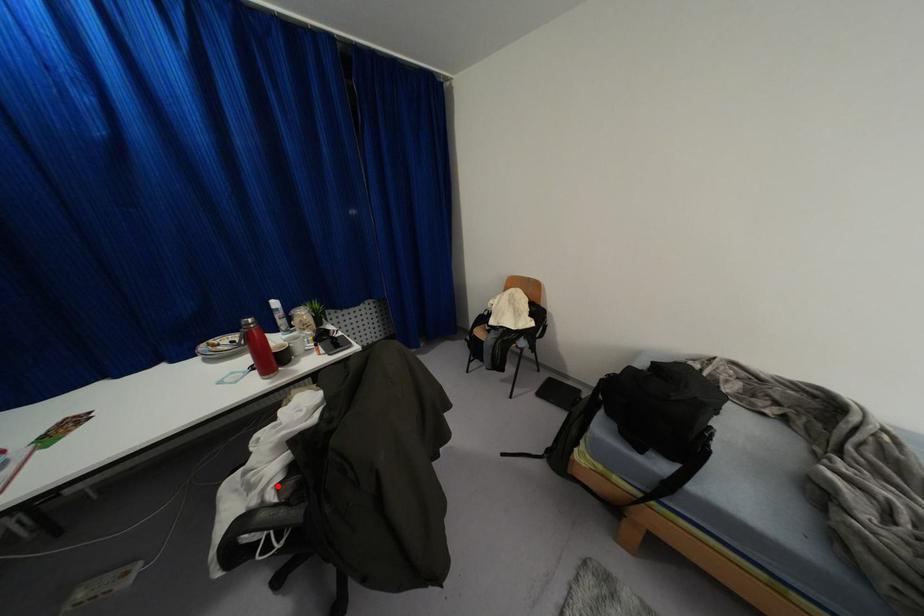
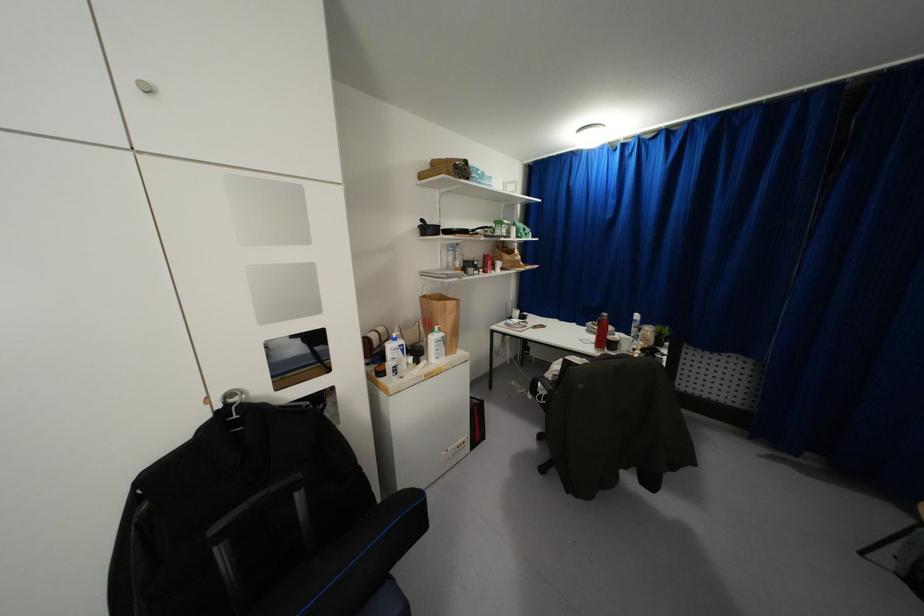
Question: I am providing you with two images of the same scene from different viewpoints. In image1, a red point is highlighted. Considering the same 3D point in image2, which of the following is correct?

Choices:
 (A) It is closer
 (B) It is farther

Answer: (A)